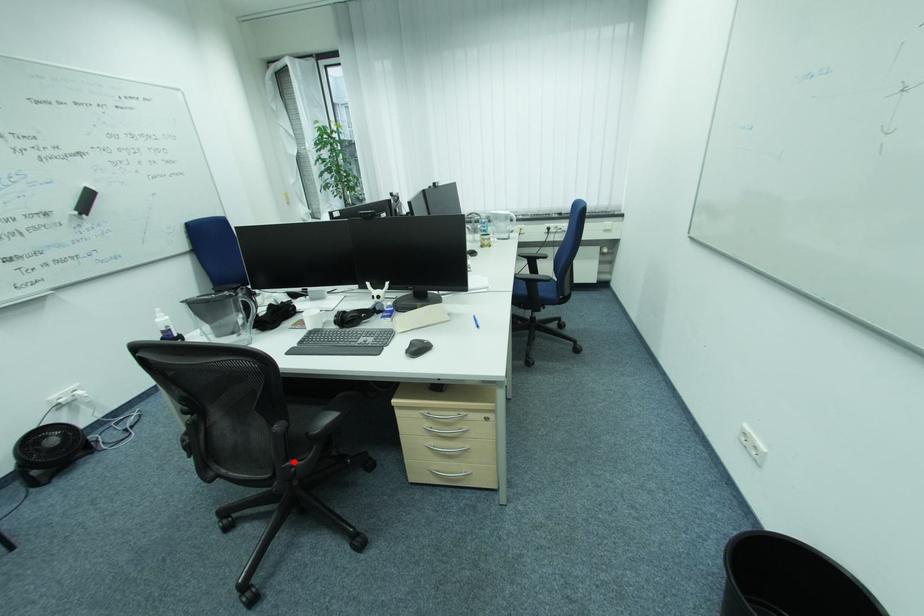
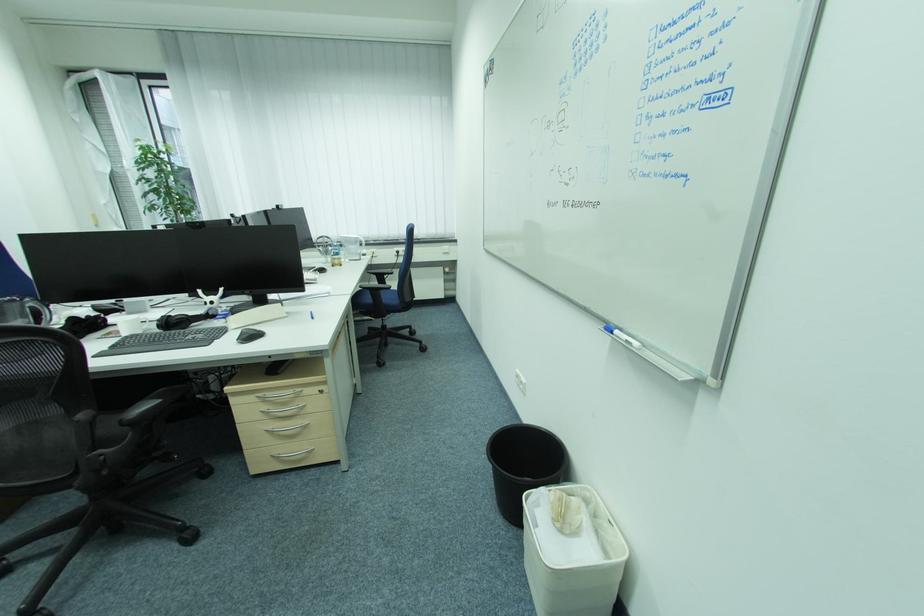
Question: I am providing you with two images of the same scene from different viewpoints. Given a red point in image1, look at the same physical point in image2. Is it:

Choices:
 (A) Closer to the viewpoint
 (B) Farther from the viewpoint

Answer: (A)